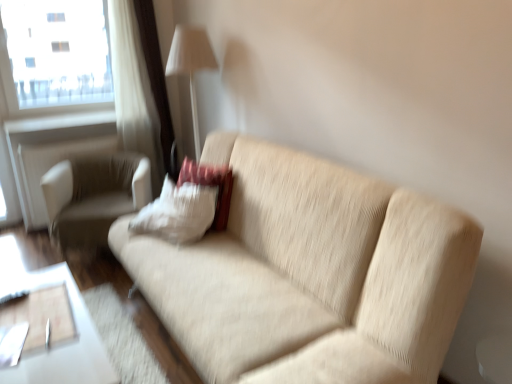
Question: From a real-world perspective, does transparent glass window at upper left stand above white fabric lampshade at upper center?

Choices:
 (A) no
 (B) yes

Answer: (B)

Question: Is transparent glass window at upper left thinner than white fabric lampshade at upper center?

Choices:
 (A) no
 (B) yes

Answer: (B)

Question: Is transparent glass window at upper left positioned with its back to white fabric lampshade at upper center?

Choices:
 (A) no
 (B) yes

Answer: (A)

Question: Is transparent glass window at upper left shorter than white fabric lampshade at upper center?

Choices:
 (A) no
 (B) yes

Answer: (B)

Question: Does transparent glass window at upper left have a larger size compared to white fabric lampshade at upper center?

Choices:
 (A) no
 (B) yes

Answer: (A)

Question: Do you think white fabric lampshade at upper center is within beige fabric couch at center, or outside of it?

Choices:
 (A) inside
 (B) outside

Answer: (B)

Question: Does point (176, 26) appear closer or farther from the camera than point (208, 140)?

Choices:
 (A) closer
 (B) farther

Answer: (B)

Question: From the image's perspective, is white fabric lampshade at upper center above or below beige fabric couch at center?

Choices:
 (A) below
 (B) above

Answer: (B)

Question: Is white fabric lampshade at upper center bigger or smaller than beige fabric couch at center?

Choices:
 (A) small
 (B) big

Answer: (A)

Question: Would you say white fabric window frame at upper left is to the left or to the right of white fabric chair at left in the picture?

Choices:
 (A) right
 (B) left

Answer: (B)

Question: Is point [117, 94] closer or farther from the camera than point [97, 205]?

Choices:
 (A) closer
 (B) farther

Answer: (B)

Question: From the image's perspective, is white fabric window frame at upper left located above or below white fabric chair at left?

Choices:
 (A) above
 (B) below

Answer: (A)

Question: From a real-world perspective, is white fabric window frame at upper left above or below white fabric chair at left?

Choices:
 (A) above
 (B) below

Answer: (A)

Question: Looking at their shapes, would you say white fabric window frame at upper left is wider or thinner than beige fabric couch at center?

Choices:
 (A) thin
 (B) wide

Answer: (A)

Question: From a real-world perspective, is white fabric window frame at upper left above or below beige fabric couch at center?

Choices:
 (A) below
 (B) above

Answer: (B)